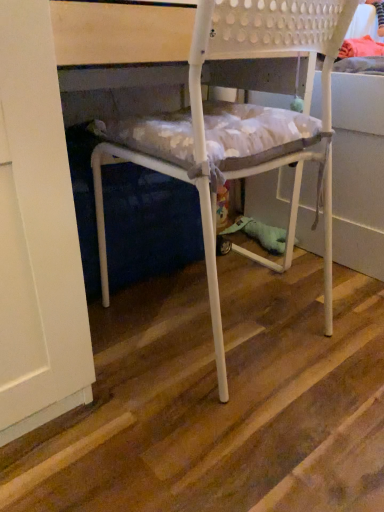
The height and width of the screenshot is (512, 384). Describe the element at coordinates (236, 126) in the screenshot. I see `white matte plastic chair at center` at that location.

You are a GUI agent. You are given a task and a screenshot of the screen. Output one action in this format:
    pyautogui.click(x=<x>, y=<y>)
    Task: Click on the white matte plastic chair at center
    This screenshot has width=384, height=512.
    Given the screenshot: What is the action you would take?
    (236, 126)

Where is `wooden at center`? wooden at center is located at coordinates (219, 403).

The width and height of the screenshot is (384, 512). What do you see at coordinates (219, 403) in the screenshot?
I see `wooden at center` at bounding box center [219, 403].

What are the coordinates of `white matte plastic chair at center` in the screenshot? It's located at (236, 126).

Which object is positioned more to the right, white matte plastic chair at center or wooden at center?

wooden at center is more to the right.

Is white matte plastic chair at center closer to camera compared to wooden at center?

No, white matte plastic chair at center is further to the viewer.

Considering the points (199, 90) and (370, 405), which point is in front, point (199, 90) or point (370, 405)?

The point (199, 90) is in front.

From the image's perspective, is white matte plastic chair at center under wooden at center?

Incorrect, from the image's perspective, white matte plastic chair at center is higher than wooden at center.

From a real-world perspective, is white matte plastic chair at center located higher than wooden at center?

Indeed, from a real-world perspective, white matte plastic chair at center stands above wooden at center.

Is white matte plastic chair at center wider than wooden at center?

No, white matte plastic chair at center is not wider than wooden at center.

In terms of height, does white matte plastic chair at center look taller or shorter compared to wooden at center?

Considering their sizes, white matte plastic chair at center has more height than wooden at center.

From the picture: Considering the relative sizes of white matte plastic chair at center and wooden at center in the image provided, is white matte plastic chair at center smaller than wooden at center?

No.

Is white matte plastic chair at center located outside wooden at center?

Absolutely, white matte plastic chair at center is external to wooden at center.

Would you consider white matte plastic chair at center to be distant from wooden at center?

white matte plastic chair at center is actually quite close to wooden at center.

Does white matte plastic chair at center turn towards wooden at center?

No.

What's the angular difference between white matte plastic chair at center and wooden at center's facing directions?

white matte plastic chair at center and wooden at center are facing 91.5 degrees away from each other.

Measure the distance between white matte plastic chair at center and wooden at center.

11.83 inches.

Locate an element on the screen. The image size is (384, 512). stair in front of the white matte plastic chair at center is located at coordinates 219,403.

Which is more to the right, wooden at center or white matte plastic chair at center?

Positioned to the right is wooden at center.

Is wooden at center further to camera compared to white matte plastic chair at center?

No, the depth of wooden at center is less than that of white matte plastic chair at center.

Does point (228, 457) appear closer or farther from the camera than point (106, 130)?

Point (228, 457) is closer to the camera than point (106, 130).

From the image's perspective, is wooden at center beneath white matte plastic chair at center?

Indeed, from the image's perspective, wooden at center is shown beneath white matte plastic chair at center.

From a real-world perspective, which object stands above the other?

white matte plastic chair at center, from a real-world perspective.

Which of these two, wooden at center or white matte plastic chair at center, is thinner?

white matte plastic chair at center.

Does wooden at center have a greater height compared to white matte plastic chair at center?

No, wooden at center is not taller than white matte plastic chair at center.

Considering the sizes of objects wooden at center and white matte plastic chair at center in the image provided, who is bigger, wooden at center or white matte plastic chair at center?

white matte plastic chair at center is bigger.

Is white matte plastic chair at center completely or partially inside wooden at center?

No, white matte plastic chair at center is not inside wooden at center.

Is wooden at center with white matte plastic chair at center?

No.

Is wooden at center turned away from white matte plastic chair at center?

No, wooden at center's orientation is not away from white matte plastic chair at center.

What's the angular difference between wooden at center and white matte plastic chair at center's facing directions?

wooden at center and white matte plastic chair at center are facing 91.5 degrees away from each other.

Locate an element on the screen. Image resolution: width=384 pixels, height=512 pixels. stair lying in front of the white matte plastic chair at center is located at coordinates (219, 403).

Identify the location of stair in front of the white matte plastic chair at center. The height and width of the screenshot is (512, 384). (219, 403).

I want to click on stair below the white matte plastic chair at center (from the image's perspective), so click(219, 403).